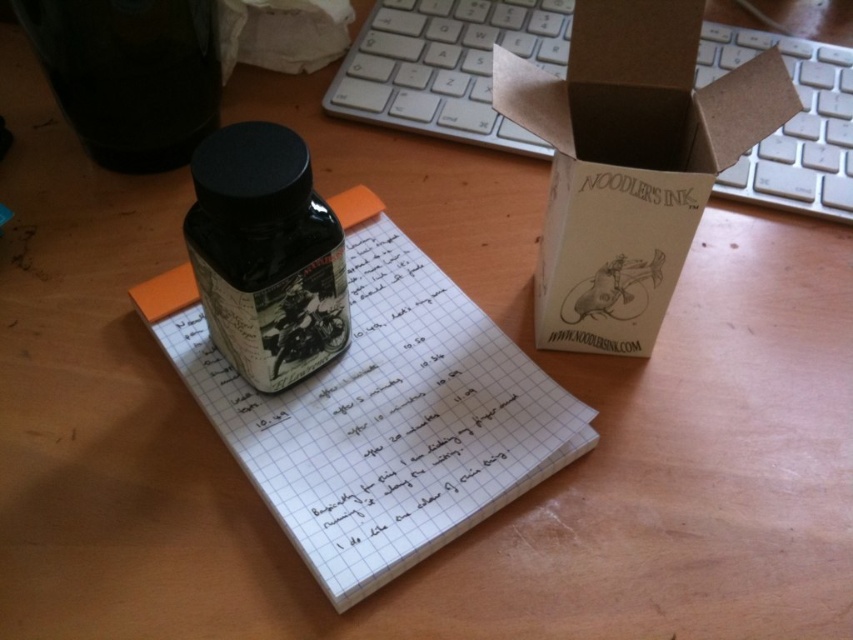
You are a graphic designer working on a project. You need to place a new sticker exactly at the point marked by the coordinates point (447,67). According to the scene description, where should you place the sticker?

The point (447,67) is on the white plastic keyboard at upper center, so you should place the sticker on the white plastic keyboard at upper center.

You are setting up a desk organizer and need to place the white plastic keyboard at upper center and the white paper at upper center in a drawer. The drawer has a width of 40 cm. Can both items fit side by side horizontally? Please consider their widths as described in the scene.

The white plastic keyboard at upper center might be wider than white paper at upper center. Since the drawer is 40 cm wide, it depends on the combined width of both items. If the keyboard is wider than the paper, their total width may exceed 40 cm, making it uncertain if they can fit side by side. Check their exact dimensions to confirm.